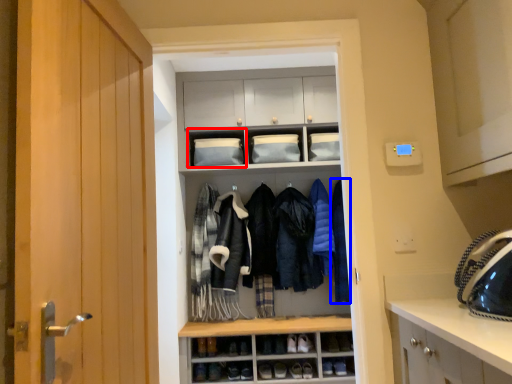
Question: Which point is closer to the camera, cabinet (highlighted by a red box) or clothing (highlighted by a blue box)?

Choices:
 (A) cabinet
 (B) clothing

Answer: (B)